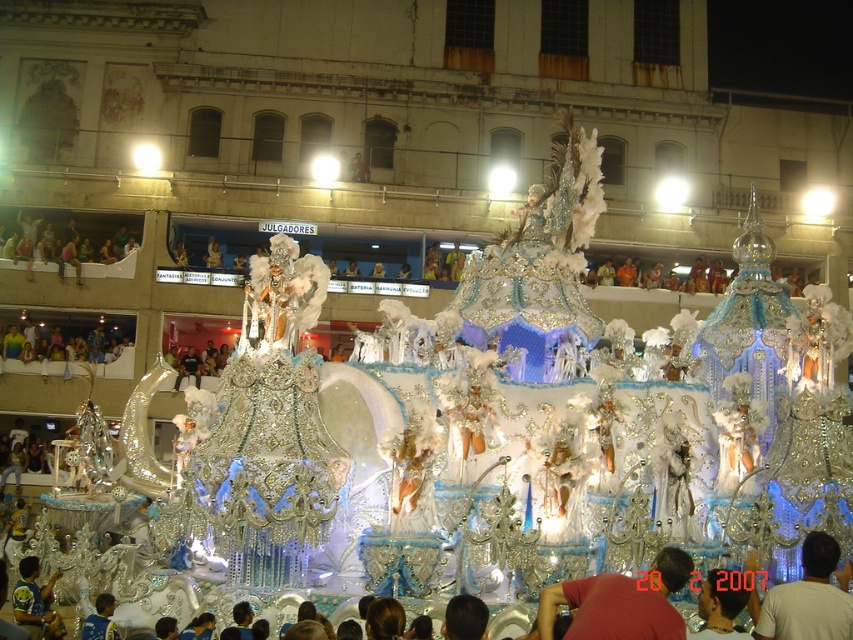
Question: Considering the relative positions of matte white figure at center and silver metallic helmet at center in the image provided, where is matte white figure at center located with respect to silver metallic helmet at center?

Choices:
 (A) right
 (B) left

Answer: (A)

Question: Which point appears farthest from the camera in this image?

Choices:
 (A) (18, 589)
 (B) (833, 544)
 (C) (717, 602)

Answer: (A)

Question: Based on their relative distances, which object is nearer to the matte white figure at center?

Choices:
 (A) silver metallic helmet at center
 (B) red fabric shirt at center
 (C) blue jersey at lower left

Answer: (A)

Question: Considering the relative positions of matte white figure at center and blue jersey at lower left in the image provided, where is matte white figure at center located with respect to blue jersey at lower left?

Choices:
 (A) above
 (B) below

Answer: (A)

Question: Which object appears closest to the camera in this image?

Choices:
 (A) blue jersey at lower left
 (B) red fabric shirt at center
 (C) matte white figure at center

Answer: (B)

Question: Can you confirm if matte white figure at center is positioned above silver metallic helmet at center?

Choices:
 (A) yes
 (B) no

Answer: (A)